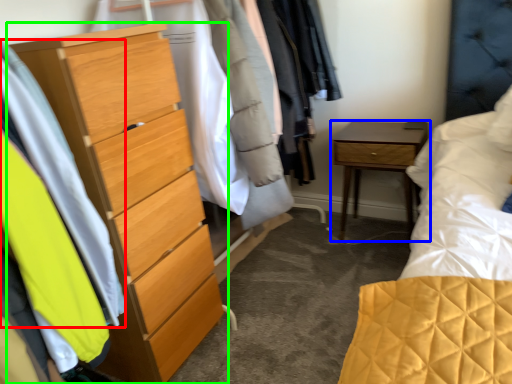
Question: Which object is the closest to the clothing (highlighted by a red box)? Choose among these: nightstand (highlighted by a blue box) or chest of drawers (highlighted by a green box).

Choices:
 (A) nightstand
 (B) chest of drawers

Answer: (B)